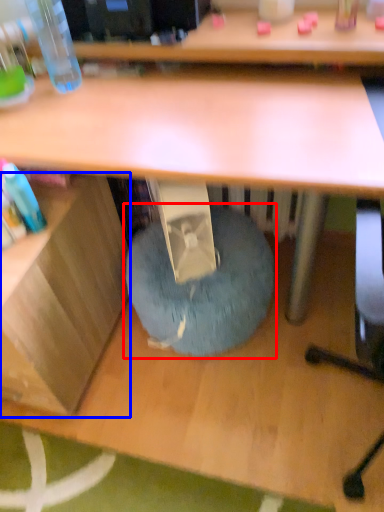
Question: Which of the following is the farthest to the observer, bean bag chair (highlighted by a red box) or shelf (highlighted by a blue box)?

Choices:
 (A) bean bag chair
 (B) shelf

Answer: (A)